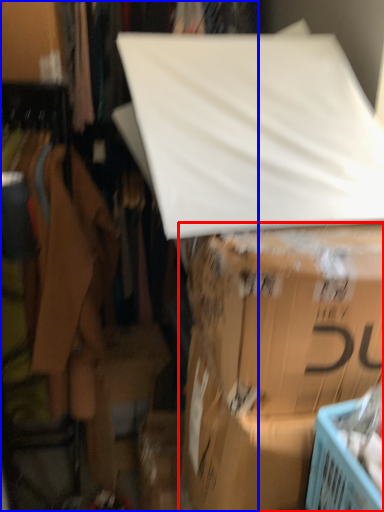
Question: Which point is further to the camera, box (highlighted by a red box) or closet (highlighted by a blue box)?

Choices:
 (A) box
 (B) closet

Answer: (B)